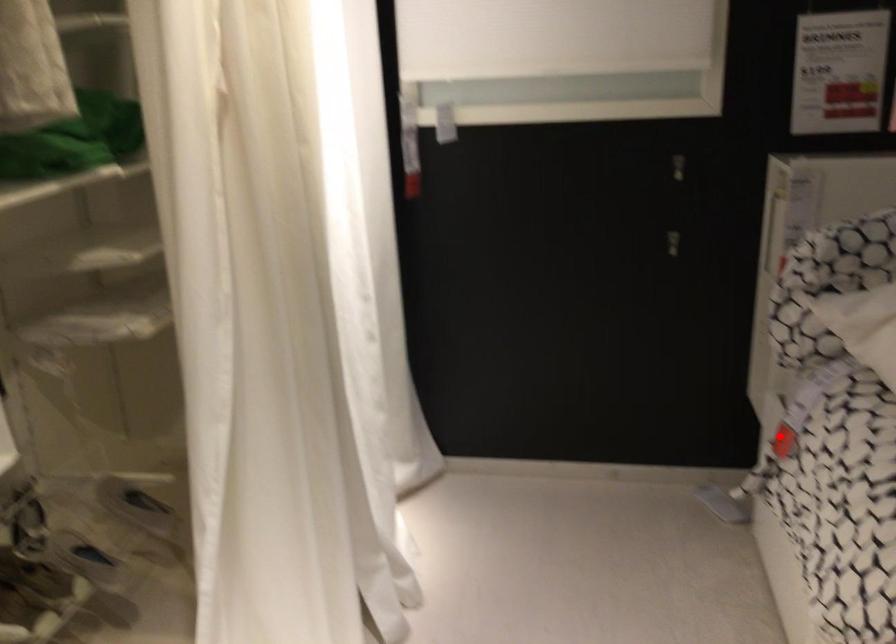
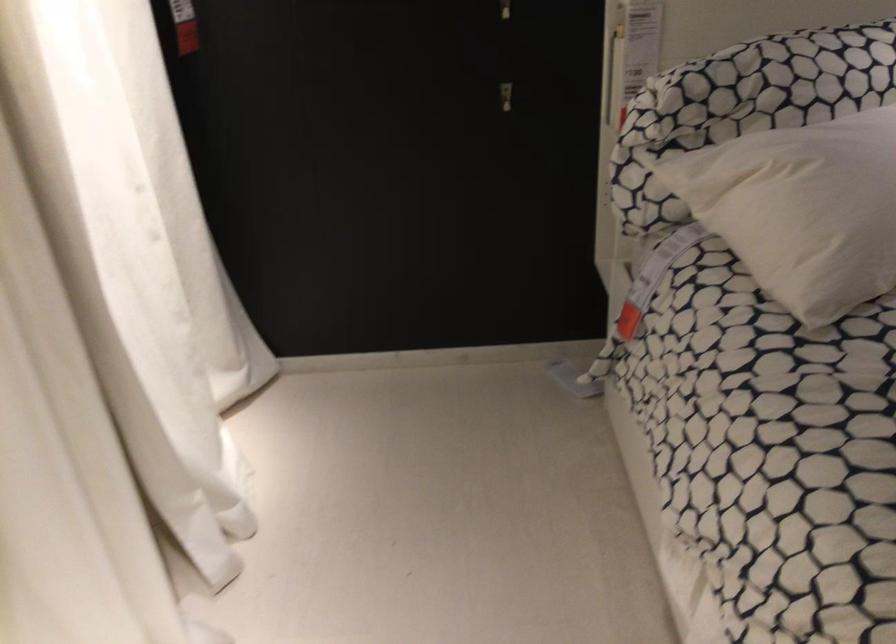
Find the pixel in the second image that matches the highlighted location in the first image.

(627, 321)